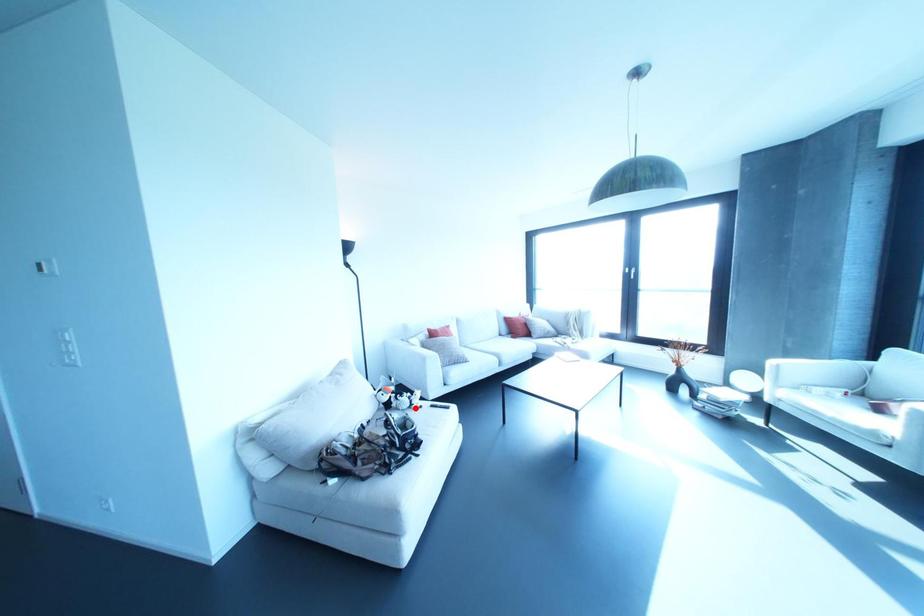
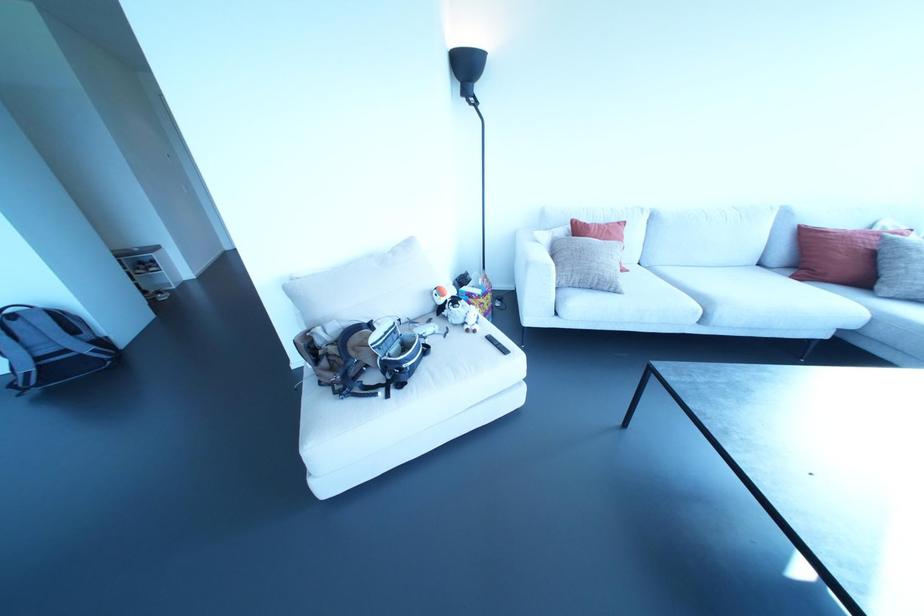
Question: I am providing you with two images of the same scene from different viewpoints. In image1, a red point is highlighted. Considering the same 3D point in image2, which of the following is correct?

Choices:
 (A) It is closer
 (B) It is farther

Answer: (B)